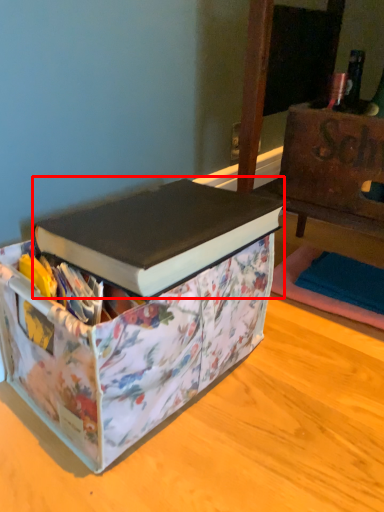
Question: From the image's perspective, considering the relative positions of book (annotated by the red box) and box in the image provided, where is book (annotated by the red box) located with respect to the staircase?

Choices:
 (A) above
 (B) below

Answer: (A)